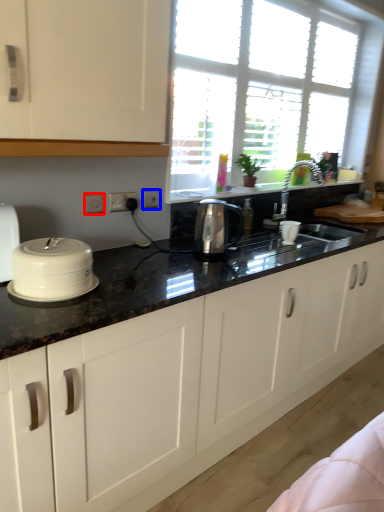
Question: Among these objects, which one is nearest to the camera, electric outlet (highlighted by a red box) or electric outlet (highlighted by a blue box)?

Choices:
 (A) electric outlet
 (B) electric outlet

Answer: (A)